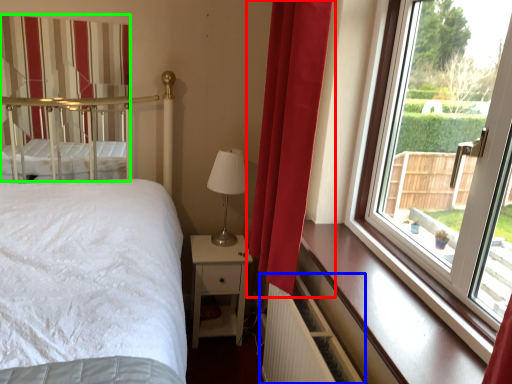
Question: Based on their relative distances, which object is farther from curtain (highlighted by a red box)? Choose from radiator (highlighted by a blue box) and curtain (highlighted by a green box).

Choices:
 (A) radiator
 (B) curtain

Answer: (B)